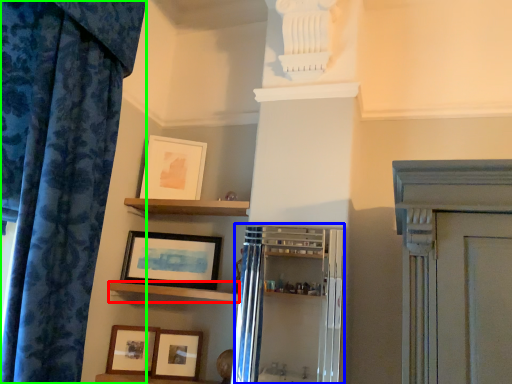
Question: Estimate the real-world distances between objects in this image. Which object is closer to shelf (highlighted by a red box), cabinetry (highlighted by a blue box) or curtain (highlighted by a green box)?

Choices:
 (A) cabinetry
 (B) curtain

Answer: (A)